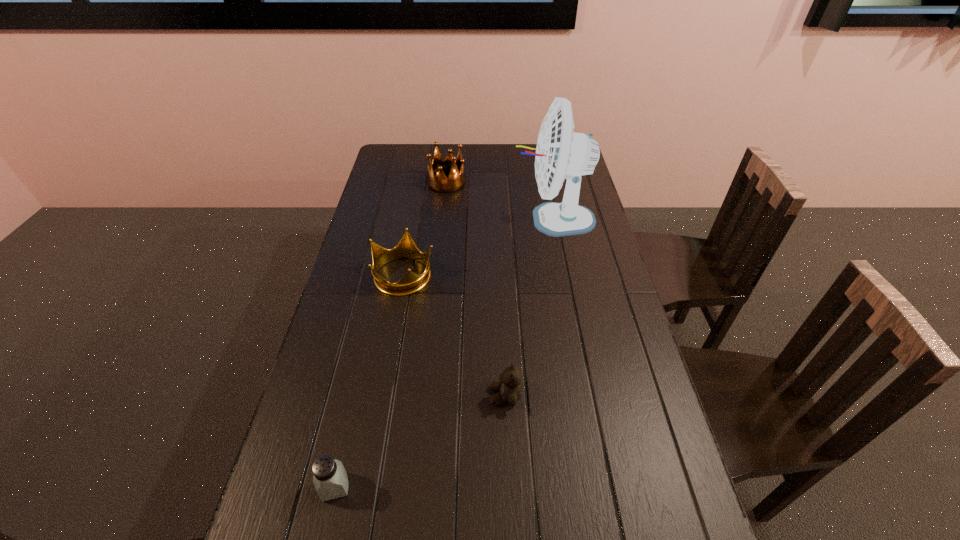
Where is `object that is at the right edge`? Image resolution: width=960 pixels, height=540 pixels. object that is at the right edge is located at coordinates (561, 153).

At what (x,y) coordinates should I click in order to perform the action: click on vacant region at the left edge of the desktop. Please return your answer as a coordinate pair (x, y). Looking at the image, I should click on (366, 267).

At what (x,y) coordinates should I click in order to perform the action: click on vacant space at the right edge of the desktop. Please return your answer as a coordinate pair (x, y). Looking at the image, I should click on (631, 459).

Locate an element on the screen. Image resolution: width=960 pixels, height=540 pixels. free space between the taller crown and the fan is located at coordinates (499, 201).

Where is `free space between the saltshaker and the teddy bear`? The width and height of the screenshot is (960, 540). free space between the saltshaker and the teddy bear is located at coordinates (420, 441).

Locate an element on the screen. The width and height of the screenshot is (960, 540). vacant area that lies between the fan and the nearer crown is located at coordinates (478, 247).

In order to click on vacant area that lies between the teddy bear and the nearest object in this screenshot , I will do `click(420, 441)`.

At what (x,y) coordinates should I click in order to perform the action: click on blank region between the nearest object and the second farthest object. Please return your answer as a coordinate pair (x, y). The image size is (960, 540). Looking at the image, I should click on (444, 353).

Locate an element on the screen. Image resolution: width=960 pixels, height=540 pixels. unoccupied area between the saltshaker and the fourth nearest object is located at coordinates (444, 353).

The width and height of the screenshot is (960, 540). I want to click on vacant area that lies between the third farthest object and the second nearest object, so click(454, 335).